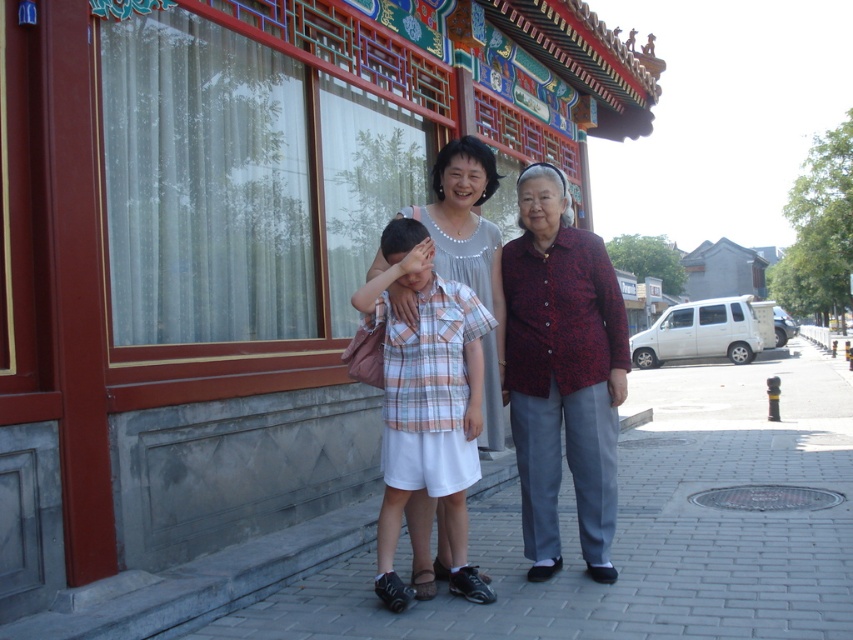
Question: Is matte plaid shirt at center wider than plaid cotton shirt at center?

Choices:
 (A) yes
 (B) no

Answer: (A)

Question: Considering the relative positions of red textured blazer at right and plaid cotton shirt at center in the image provided, where is red textured blazer at right located with respect to plaid cotton shirt at center?

Choices:
 (A) below
 (B) above

Answer: (B)

Question: Is red textured blazer at right in front of plaid cotton shirt at center?

Choices:
 (A) yes
 (B) no

Answer: (B)

Question: Which of the following is the closest to the observer?

Choices:
 (A) (457, 560)
 (B) (538, 232)
 (C) (483, 173)

Answer: (A)

Question: Which of the following is the farthest from the observer?

Choices:
 (A) (625, 352)
 (B) (422, 243)

Answer: (A)

Question: Which point appears farthest from the camera in this image?

Choices:
 (A) (619, 378)
 (B) (543, 534)
 (C) (444, 317)

Answer: (B)